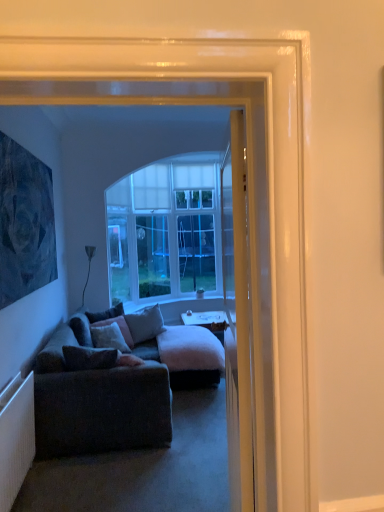
Question: Is white glossy desk at center at the right side of dark blue textured painting at upper left?

Choices:
 (A) no
 (B) yes

Answer: (B)

Question: Is white glossy desk at center further to the viewer compared to dark blue textured painting at upper left?

Choices:
 (A) no
 (B) yes

Answer: (B)

Question: Considering the relative positions of white glossy desk at center and dark blue textured painting at upper left in the image provided, is white glossy desk at center to the left of dark blue textured painting at upper left from the viewer's perspective?

Choices:
 (A) no
 (B) yes

Answer: (A)

Question: From a real-world perspective, is white glossy desk at center physically above dark blue textured painting at upper left?

Choices:
 (A) no
 (B) yes

Answer: (A)

Question: Does white glossy desk at center have a lesser width compared to dark blue textured painting at upper left?

Choices:
 (A) yes
 (B) no

Answer: (B)

Question: Is point (135, 324) closer or farther from the camera than point (21, 165)?

Choices:
 (A) farther
 (B) closer

Answer: (A)

Question: Considering their positions, is gray fabric pillow at center, the second pillow viewed from the back, located in front of or behind dark blue textured painting at upper left?

Choices:
 (A) front
 (B) behind

Answer: (B)

Question: In terms of size, does gray fabric pillow at center, positioned as the third pillow in front-to-back order, appear bigger or smaller than dark blue textured painting at upper left?

Choices:
 (A) big
 (B) small

Answer: (B)

Question: In the image, is gray fabric pillow at center, positioned as the third pillow in front-to-back order, on the left side or the right side of dark blue textured painting at upper left?

Choices:
 (A) left
 (B) right

Answer: (B)

Question: Is white glossy door at center to the left or to the right of velvet gray pillow at center, which is counted as the fourth pillow, starting from the front, in the image?

Choices:
 (A) left
 (B) right

Answer: (B)

Question: Do you think white glossy door at center is within velvet gray pillow at center, which is counted as the fourth pillow, starting from the front, or outside of it?

Choices:
 (A) outside
 (B) inside

Answer: (A)

Question: From the image's perspective, is white glossy door at center located above or below velvet gray pillow at center, which is the 1th pillow from back to front?

Choices:
 (A) below
 (B) above

Answer: (B)

Question: From their relative heights in the image, would you say white glossy door at center is taller or shorter than velvet gray pillow at center, which is counted as the fourth pillow, starting from the front?

Choices:
 (A) tall
 (B) short

Answer: (A)

Question: Would you say white textured radiator at lower left is inside or outside white glossy door at center?

Choices:
 (A) inside
 (B) outside

Answer: (B)

Question: Relative to white glossy door at center, is white textured radiator at lower left in front or behind?

Choices:
 (A) behind
 (B) front

Answer: (A)